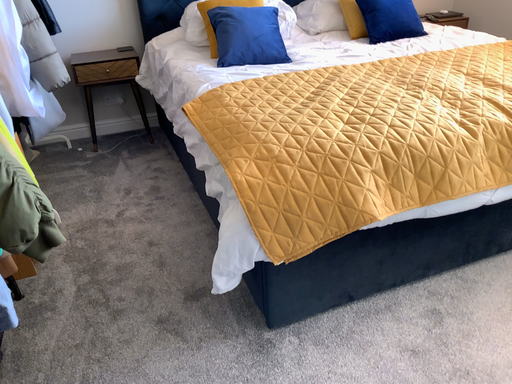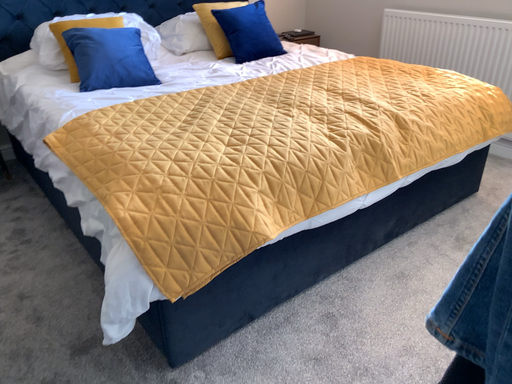
Question: How did the camera likely rotate when shooting the video?

Choices:
 (A) rotated left
 (B) rotated right

Answer: (B)